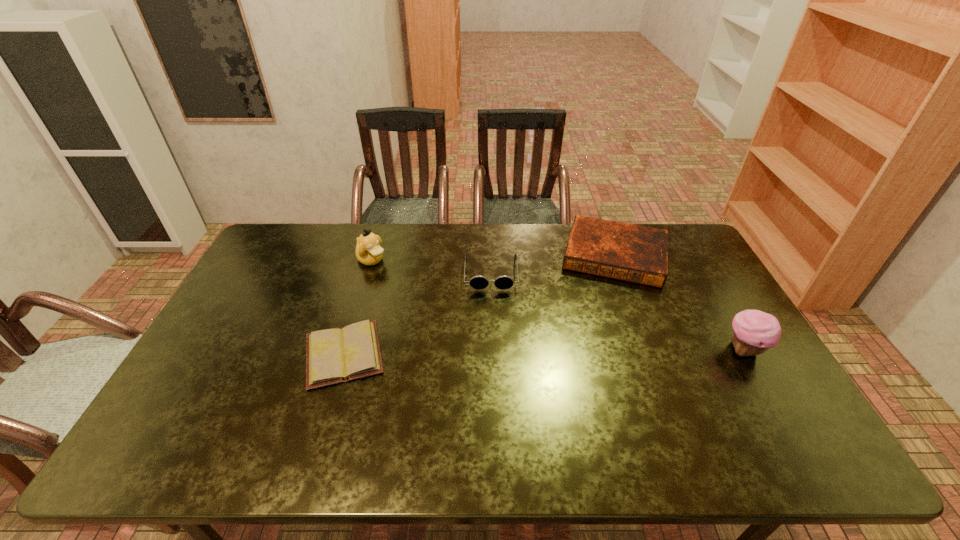
Identify the location of free location that satisfies the following two spatial constraints: 1. on the front side of the sunglasses; 2. on the right side of the duckling. The width and height of the screenshot is (960, 540). (368, 273).

Find the location of a particular element. This screenshot has width=960, height=540. free spot that satisfies the following two spatial constraints: 1. on the back side of the diary; 2. on the right side of the Bible is located at coordinates (373, 255).

You are a GUI agent. You are given a task and a screenshot of the screen. Output one action in this format:
    pyautogui.click(x=<x>, y=<y>)
    Task: Click on the vacant space that satisfies the following two spatial constraints: 1. on the back side of the diary; 2. on the left side of the rightmost object
    Image resolution: width=960 pixels, height=540 pixels.
    Given the screenshot: What is the action you would take?
    pyautogui.click(x=346, y=350)